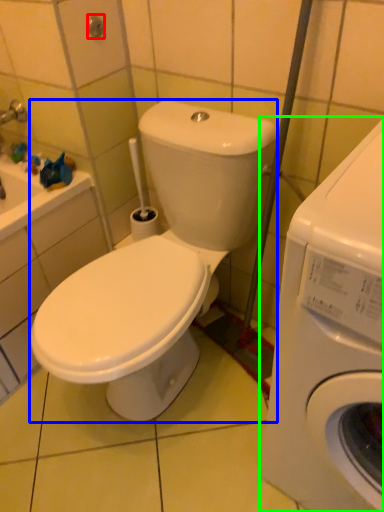
Question: Which object is positioned farthest from shower (highlighted by a red box)? Select from washing machine (highlighted by a blue box) and washing machine (highlighted by a green box).

Choices:
 (A) washing machine
 (B) washing machine

Answer: (B)